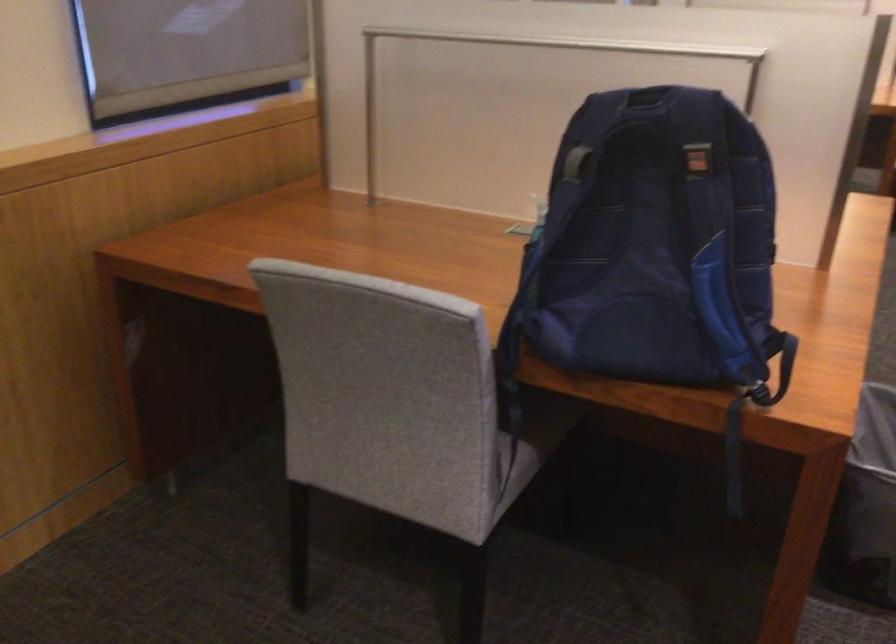
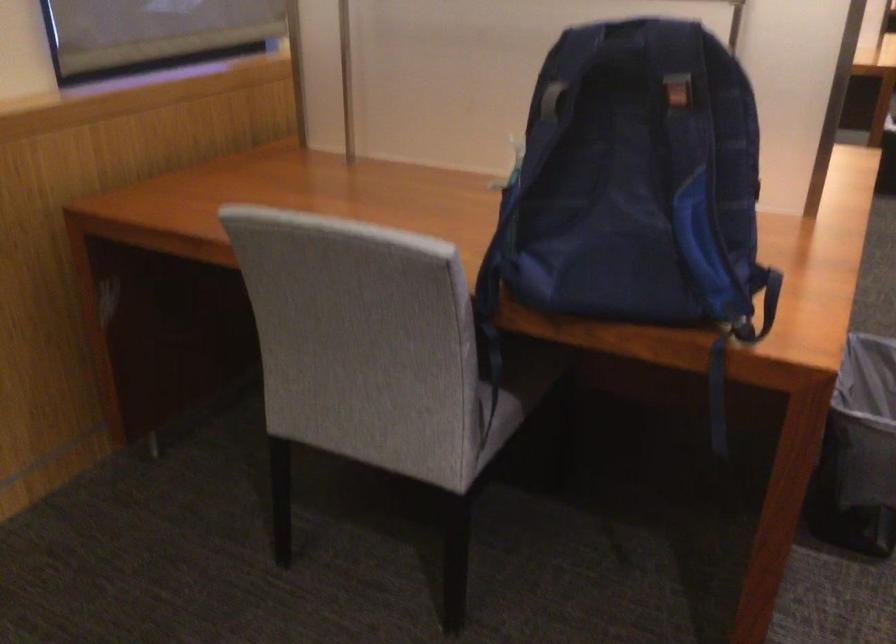
Where in the second image is the point corresponding to (x=573, y=166) from the first image?

(552, 100)